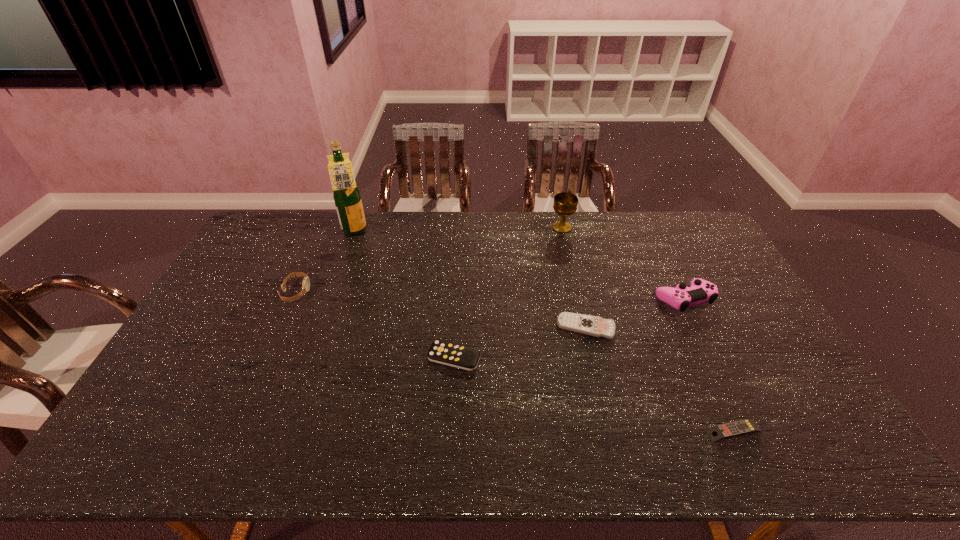
Image resolution: width=960 pixels, height=540 pixels. I want to click on empty space that is in between the nearest remote control and the fourth shortest object, so click(x=515, y=362).

The width and height of the screenshot is (960, 540). Identify the location of free space between the leftmost object and the fifth shortest object. (490, 295).

Locate an element on the screen. vacant region between the fifth shortest object and the fourth shortest object is located at coordinates (490, 295).

Image resolution: width=960 pixels, height=540 pixels. I want to click on unoccupied area between the sixth shortest object and the leftmost object, so click(x=429, y=260).

What are the coordinates of `vacant space that's between the chalice and the nearest object` in the screenshot? It's located at (648, 329).

Image resolution: width=960 pixels, height=540 pixels. I want to click on free spot between the second remote control from right to left and the control, so click(635, 313).

This screenshot has width=960, height=540. What are the coordinates of `vacant point located between the farthest remote control and the control` in the screenshot? It's located at (635, 313).

Locate which object ranks fifth in proximity to the liquor. Please provide its 2D coordinates. Your answer should be formatted as a tuple, i.e. [(x, y)], where the tuple contains the x and y coordinates of a point satisfying the conditions above.

[(700, 291)]

Locate which object is the sixth closest to the nearest object. Please provide its 2D coordinates. Your answer should be formatted as a tuple, i.e. [(x, y)], where the tuple contains the x and y coordinates of a point satisfying the conditions above.

[(346, 194)]

The image size is (960, 540). Find the location of `remote control that is the third nearest to the chalice`. remote control that is the third nearest to the chalice is located at coordinates (746, 426).